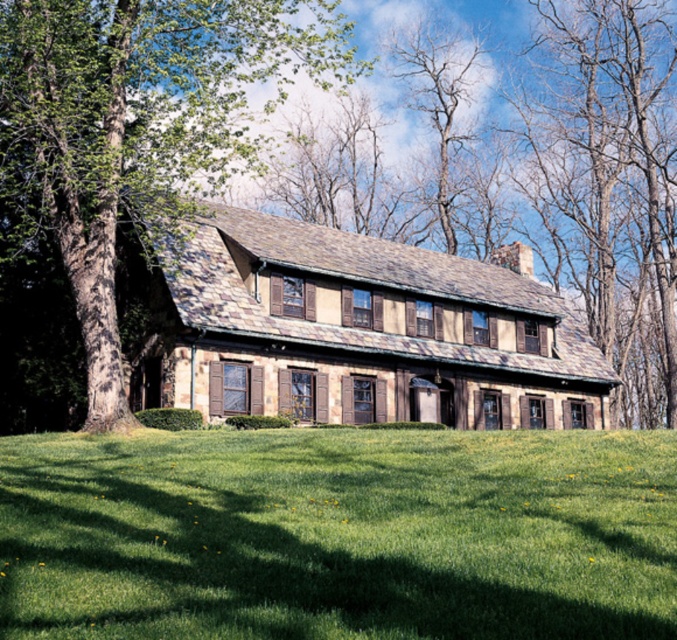
Locate an element on the screen. The image size is (677, 640). green grass at lower center is located at coordinates (338, 534).

Which is above, green grass at lower center or green leafy tree at left?

green leafy tree at left is above.

Who is more distant from viewer, [167,554] or [18,140]?

Point [18,140]

I want to click on green grass at lower center, so click(x=338, y=534).